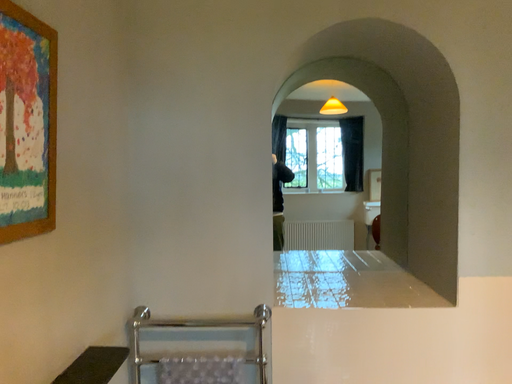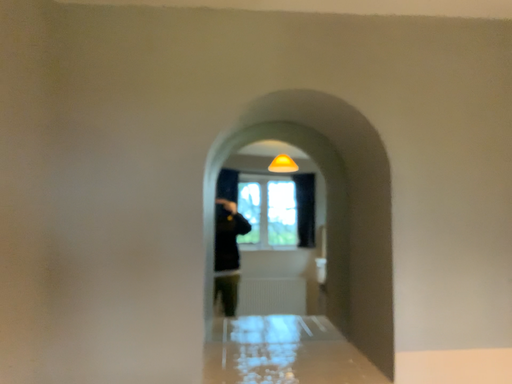
Question: Which way did the camera rotate in the video?

Choices:
 (A) rotated downward
 (B) rotated upward

Answer: (B)